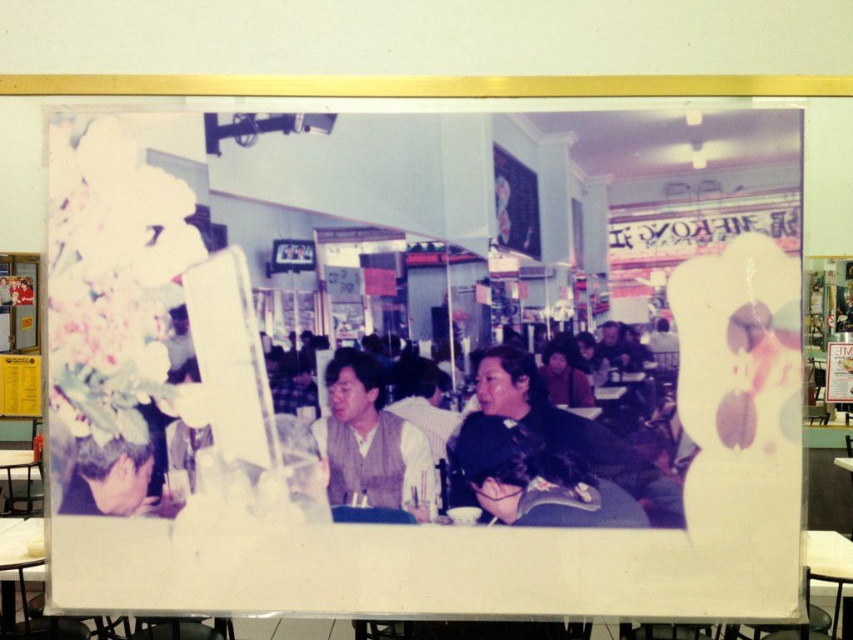
Question: Does dark brown hair at center have a larger size compared to light brown vest at center?

Choices:
 (A) no
 (B) yes

Answer: (A)

Question: Which point is farther to the camera?

Choices:
 (A) dark brown hair at center
 (B) blonde hair at lower left
 (C) light brown vest at center

Answer: (B)

Question: Does light brown vest at center have a greater width compared to blonde hair at lower left?

Choices:
 (A) yes
 (B) no

Answer: (B)

Question: Among these points, which one is nearest to the camera?

Choices:
 (A) (160, 413)
 (B) (357, 481)

Answer: (A)

Question: Which point is farther from the camera taking this photo?

Choices:
 (A) (161, 413)
 (B) (349, 472)

Answer: (B)

Question: Does dark brown hair at center have a smaller size compared to blonde hair at lower left?

Choices:
 (A) no
 (B) yes

Answer: (A)